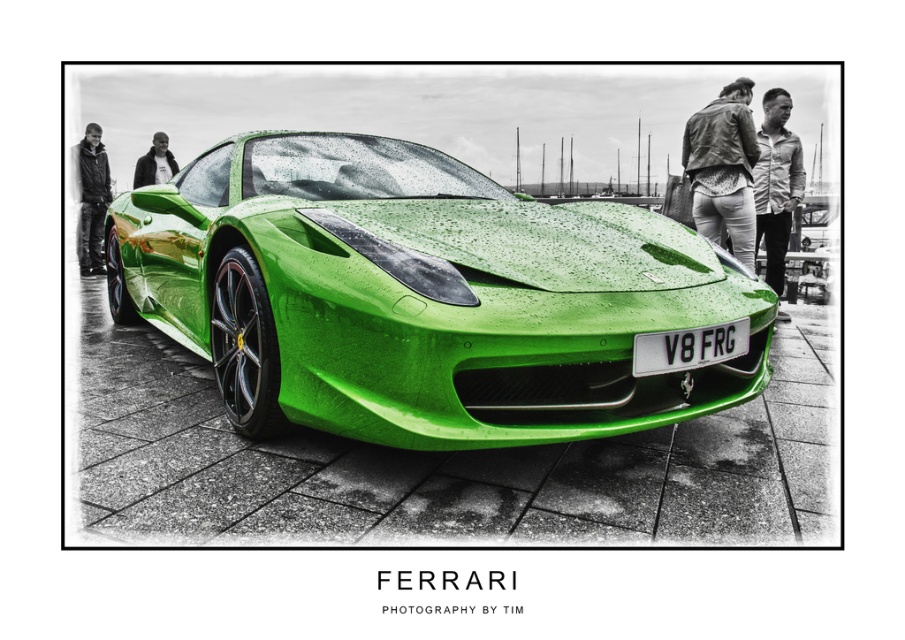
Does black plastic license plate at center have a lesser height compared to black leather jacket at left?

Correct, black plastic license plate at center is not as tall as black leather jacket at left.

Locate an element on the screen. black plastic license plate at center is located at coordinates (688, 348).

Does leather jacket at upper center have a greater height compared to matte black jacket at upper left?

Correct, leather jacket at upper center is much taller as matte black jacket at upper left.

Does leather jacket at upper center have a lesser height compared to matte black jacket at upper left?

No, leather jacket at upper center is not shorter than matte black jacket at upper left.

Does point (729, 193) come farther from viewer compared to point (160, 140)?

No, (729, 193) is in front of (160, 140).

Where is `leather jacket at upper center`? The width and height of the screenshot is (905, 640). leather jacket at upper center is located at coordinates (724, 168).

Can you confirm if leather jacket at upper center is wider than black plastic license plate at center?

In fact, leather jacket at upper center might be narrower than black plastic license plate at center.

Who is taller, leather jacket at upper center or black plastic license plate at center?

leather jacket at upper center is taller.

You are a GUI agent. You are given a task and a screenshot of the screen. Output one action in this format:
    pyautogui.click(x=<x>, y=<y>)
    Task: Click on the leather jacket at upper center
    The width and height of the screenshot is (905, 640).
    Given the screenshot: What is the action you would take?
    pyautogui.click(x=724, y=168)